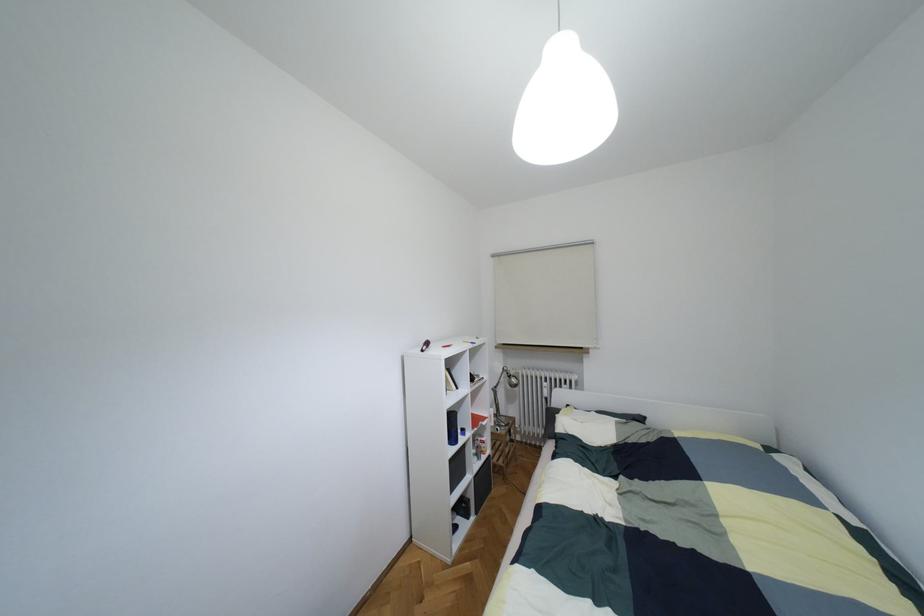
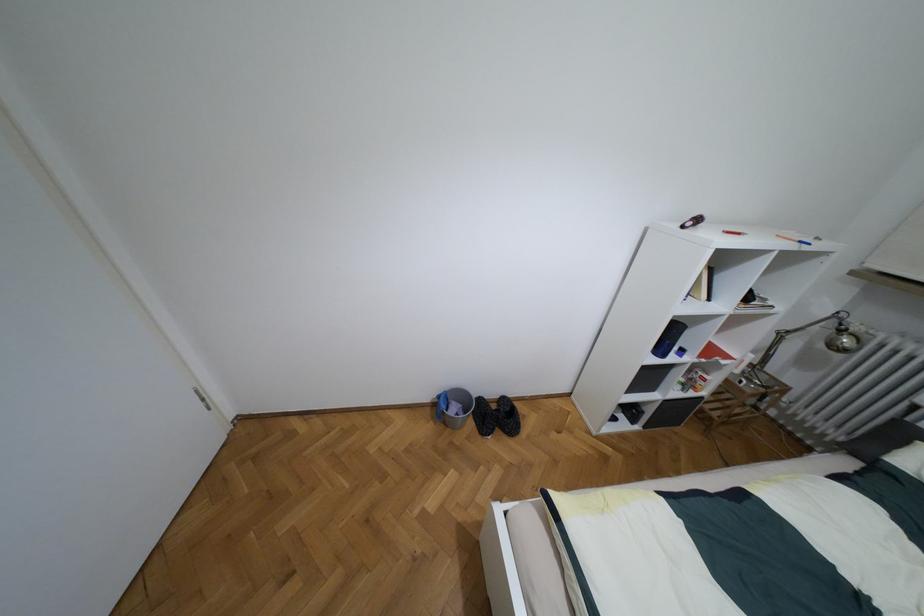
Based on the continuous images, in which direction is the camera rotating?

The camera rotated toward left-down.